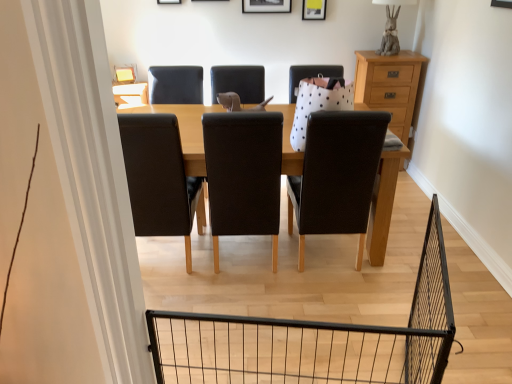
Image resolution: width=512 pixels, height=384 pixels. In order to click on matte yellow picture frame at upper center, placed as the first picture frame when sorted from right to left in this screenshot , I will do `click(314, 10)`.

The width and height of the screenshot is (512, 384). What do you see at coordinates (389, 86) in the screenshot?
I see `light brown wooden chest of drawers at right` at bounding box center [389, 86].

Identify the location of matte yellow picture frame at upper center, which ranks as the second picture frame in left-to-right order. The image size is (512, 384). (314, 10).

Considering the points (401, 136) and (305, 13), which point is in front, point (401, 136) or point (305, 13)?

The point (305, 13) is closer to the camera.

In terms of height, does light brown wooden chest of drawers at right look taller or shorter compared to matte yellow picture frame at upper center, which ranks as the second picture frame in left-to-right order?

In the image, light brown wooden chest of drawers at right appears to be taller than matte yellow picture frame at upper center, which ranks as the second picture frame in left-to-right order.

Are light brown wooden chest of drawers at right and matte yellow picture frame at upper center, placed as the first picture frame when sorted from right to left, far apart?

No, light brown wooden chest of drawers at right is in close proximity to matte yellow picture frame at upper center, placed as the first picture frame when sorted from right to left.

Considering the relative sizes of light brown wooden chest of drawers at right and matte yellow picture frame at upper center, which ranks as the second picture frame in left-to-right order, in the image provided, is light brown wooden chest of drawers at right thinner than matte yellow picture frame at upper center, which ranks as the second picture frame in left-to-right order,?

Incorrect, the width of light brown wooden chest of drawers at right is not less than that of matte yellow picture frame at upper center, which ranks as the second picture frame in left-to-right order.

Is matte yellow picture frame at upper center, which ranks as the second picture frame in left-to-right order, not inside light brown wooden chest of drawers at right?

Yes, matte yellow picture frame at upper center, which ranks as the second picture frame in left-to-right order, is located beyond the bounds of light brown wooden chest of drawers at right.

Locate an element on the screen. The height and width of the screenshot is (384, 512). the chest of drawers that is below the matte yellow picture frame at upper center, placed as the first picture frame when sorted from right to left (from the image's perspective) is located at coordinates (389, 86).

Can you confirm if matte yellow picture frame at upper center, which ranks as the second picture frame in left-to-right order, is positioned to the right of light brown wooden chest of drawers at right?

No, matte yellow picture frame at upper center, which ranks as the second picture frame in left-to-right order, is not to the right of light brown wooden chest of drawers at right.

Considering their positions, is matte yellow picture frame at upper center, placed as the first picture frame when sorted from right to left, located in front of or behind light brown wooden chest of drawers at right?

In the image, matte yellow picture frame at upper center, placed as the first picture frame when sorted from right to left, appears behind light brown wooden chest of drawers at right.

Between light brown wooden chest of drawers at right and black matte picture frame at upper center, positioned as the 1th picture frame in left-to-right order, which one has smaller width?

black matte picture frame at upper center, positioned as the 1th picture frame in left-to-right order, is thinner.

Is light brown wooden chest of drawers at right beside black matte picture frame at upper center, which is the second picture frame in right-to-left order?

There is a gap between light brown wooden chest of drawers at right and black matte picture frame at upper center, which is the second picture frame in right-to-left order.

Can we say light brown wooden chest of drawers at right lies outside black matte picture frame at upper center, which is the second picture frame in right-to-left order?

light brown wooden chest of drawers at right is positioned outside black matte picture frame at upper center, which is the second picture frame in right-to-left order.

Where is `picture frame that is the 2nd object to the left of the light brown wooden chest of drawers at right, starting at the anchor`? The height and width of the screenshot is (384, 512). picture frame that is the 2nd object to the left of the light brown wooden chest of drawers at right, starting at the anchor is located at coordinates (266, 6).

Does point (325, 15) come in front of point (278, 11)?

No.

Is matte yellow picture frame at upper center, placed as the first picture frame when sorted from right to left, facing away from black matte picture frame at upper center, positioned as the 1th picture frame in left-to-right order?

matte yellow picture frame at upper center, placed as the first picture frame when sorted from right to left, does not have its back to black matte picture frame at upper center, positioned as the 1th picture frame in left-to-right order.

From the image's perspective, is matte yellow picture frame at upper center, placed as the first picture frame when sorted from right to left, above or below black matte picture frame at upper center, which is the second picture frame in right-to-left order?

matte yellow picture frame at upper center, placed as the first picture frame when sorted from right to left, is below black matte picture frame at upper center, which is the second picture frame in right-to-left order.

Considering the positions of objects matte yellow picture frame at upper center, which ranks as the second picture frame in left-to-right order, and black matte picture frame at upper center, which is the second picture frame in right-to-left order, in the image provided, who is more to the left, matte yellow picture frame at upper center, which ranks as the second picture frame in left-to-right order, or black matte picture frame at upper center, which is the second picture frame in right-to-left order,?

black matte picture frame at upper center, which is the second picture frame in right-to-left order.

Between black matte picture frame at upper center, which is the second picture frame in right-to-left order, and matte yellow picture frame at upper center, which ranks as the second picture frame in left-to-right order, which one appears on the right side from the viewer's perspective?

From the viewer's perspective, matte yellow picture frame at upper center, which ranks as the second picture frame in left-to-right order, appears more on the right side.

Could you measure the distance between black matte picture frame at upper center, positioned as the 1th picture frame in left-to-right order, and matte yellow picture frame at upper center, which ranks as the second picture frame in left-to-right order?

They are 10.69 inches apart.

From the picture: Can you confirm if black matte picture frame at upper center, positioned as the 1th picture frame in left-to-right order, is wider than matte yellow picture frame at upper center, placed as the first picture frame when sorted from right to left?

Indeed, black matte picture frame at upper center, positioned as the 1th picture frame in left-to-right order, has a greater width compared to matte yellow picture frame at upper center, placed as the first picture frame when sorted from right to left.

Does point (262, 12) come behind point (306, 2)?

Yes.

Could you measure the distance between black matte picture frame at upper center, positioned as the 1th picture frame in left-to-right order, and light brown wooden chest of drawers at right?

black matte picture frame at upper center, positioned as the 1th picture frame in left-to-right order, is 1.06 meters from light brown wooden chest of drawers at right.

Considering the relative sizes of black matte picture frame at upper center, positioned as the 1th picture frame in left-to-right order, and light brown wooden chest of drawers at right in the image provided, is black matte picture frame at upper center, positioned as the 1th picture frame in left-to-right order, shorter than light brown wooden chest of drawers at right?

Yes, black matte picture frame at upper center, positioned as the 1th picture frame in left-to-right order, is shorter than light brown wooden chest of drawers at right.

From the image's perspective, who appears lower, black matte picture frame at upper center, positioned as the 1th picture frame in left-to-right order, or light brown wooden chest of drawers at right?

light brown wooden chest of drawers at right appears lower in the image.

Is black matte picture frame at upper center, which is the second picture frame in right-to-left order, inside the boundaries of light brown wooden chest of drawers at right, or outside?

black matte picture frame at upper center, which is the second picture frame in right-to-left order, is not inside light brown wooden chest of drawers at right, it's outside.

The image size is (512, 384). In order to click on chest of drawers below the matte yellow picture frame at upper center, which ranks as the second picture frame in left-to-right order (from a real-world perspective) in this screenshot , I will do `click(389, 86)`.

The height and width of the screenshot is (384, 512). What are the coordinates of `picture frame that is the 1st object located above the light brown wooden chest of drawers at right (from the image's perspective)` in the screenshot? It's located at (314, 10).

From the image, which object appears to be farther from matte yellow picture frame at upper center, which ranks as the second picture frame in left-to-right order, black matte picture frame at upper center, positioned as the 1th picture frame in left-to-right order, or light brown wooden chest of drawers at right?

light brown wooden chest of drawers at right is positioned further to the anchor matte yellow picture frame at upper center, which ranks as the second picture frame in left-to-right order.

Looking at the image, which one is located further to black matte picture frame at upper center, positioned as the 1th picture frame in left-to-right order, light brown wooden chest of drawers at right or matte yellow picture frame at upper center, which ranks as the second picture frame in left-to-right order?

light brown wooden chest of drawers at right is positioned further to the anchor black matte picture frame at upper center, positioned as the 1th picture frame in left-to-right order.

From the image, which object appears to be farther from black matte picture frame at upper center, positioned as the 1th picture frame in left-to-right order, matte yellow picture frame at upper center, which ranks as the second picture frame in left-to-right order, or light brown wooden chest of drawers at right?

light brown wooden chest of drawers at right is positioned further to the anchor black matte picture frame at upper center, positioned as the 1th picture frame in left-to-right order.

Estimate the real-world distances between objects in this image. Which object is further from light brown wooden chest of drawers at right, matte yellow picture frame at upper center, placed as the first picture frame when sorted from right to left, or black matte picture frame at upper center, positioned as the 1th picture frame in left-to-right order?

black matte picture frame at upper center, positioned as the 1th picture frame in left-to-right order, is positioned further to the anchor light brown wooden chest of drawers at right.

Which object lies nearer to the anchor point light brown wooden chest of drawers at right, black matte picture frame at upper center, positioned as the 1th picture frame in left-to-right order, or matte yellow picture frame at upper center, which ranks as the second picture frame in left-to-right order?

matte yellow picture frame at upper center, which ranks as the second picture frame in left-to-right order, lies closer to light brown wooden chest of drawers at right than the other object.

Based on their spatial positions, is light brown wooden chest of drawers at right or black matte picture frame at upper center, which is the second picture frame in right-to-left order, further from matte yellow picture frame at upper center, placed as the first picture frame when sorted from right to left?

light brown wooden chest of drawers at right is further to matte yellow picture frame at upper center, placed as the first picture frame when sorted from right to left.

You are a GUI agent. You are given a task and a screenshot of the screen. Output one action in this format:
    pyautogui.click(x=<x>, y=<y>)
    Task: Click on the picture frame between black matte picture frame at upper center, which is the second picture frame in right-to-left order, and light brown wooden chest of drawers at right from top to bottom
    This screenshot has width=512, height=384.
    Given the screenshot: What is the action you would take?
    pyautogui.click(x=314, y=10)